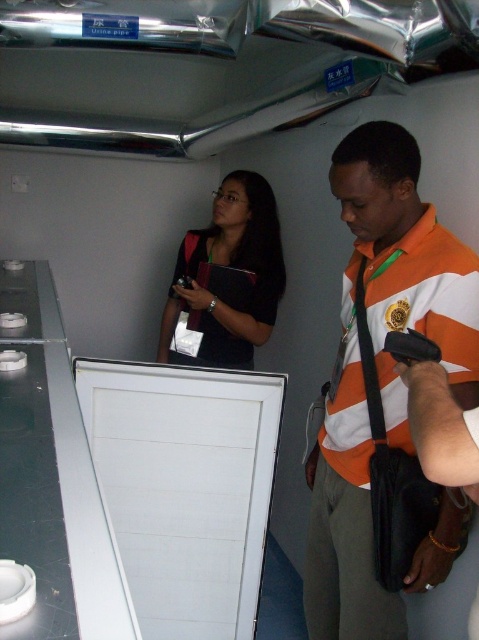
You are standing in the room depicted in the image. Where exactly is the orange striped shirt at center located in terms of coordinates?

The orange striped shirt at center is located at coordinates point (379,369).

You are an interior designer assessing the space between the orange striped shirt at center and the black matte laptop at upper center. Which object takes up more visual space in the scene?

The orange striped shirt at center has a larger size compared to the black matte laptop at upper center, so it takes up more visual space in the scene.

You are a delivery person who needs to place a package that is 30 inches long on the floor between the orange striped shirt at center and the black matte laptop at upper center. Is there enough space for the package?

The distance between the orange striped shirt at center and the black matte laptop at upper center is 32.61 inches. Since the package is 30 inches long, there is enough space to place it between them.